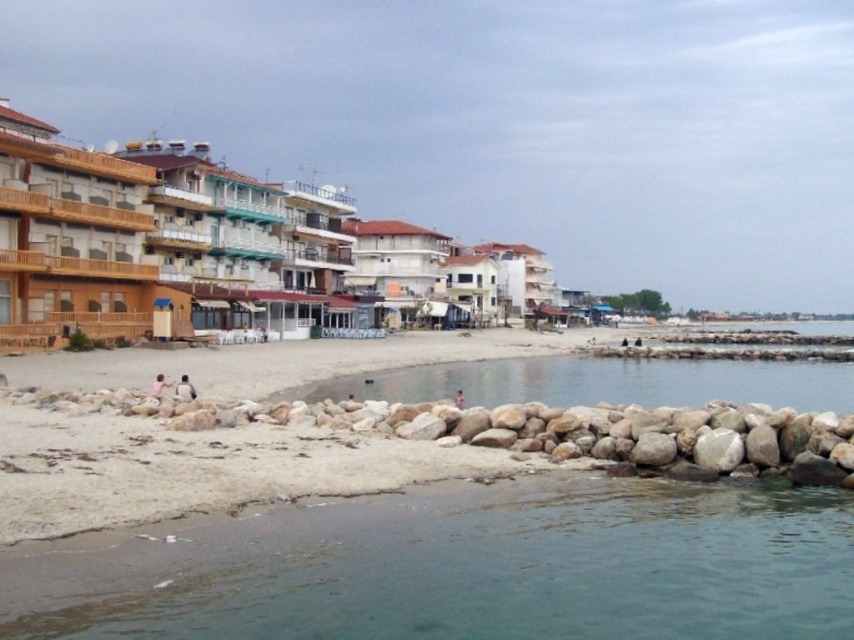
Question: Which of the following is the farthest from the observer?

Choices:
 (A) clear water at center
 (B) light brown wooden chair at lower left
 (C) light brown sand at center

Answer: (A)

Question: Among these points, which one is nearest to the camera?

Choices:
 (A) (18, 237)
 (B) (127, 228)

Answer: (A)

Question: Can you confirm if clear water at lower left is thinner than light brown sand at center?

Choices:
 (A) no
 (B) yes

Answer: (A)

Question: From the image, what is the correct spatial relationship of dark blue fabric person at lower left in relation to light brown wooden chair at lower left?

Choices:
 (A) below
 (B) above

Answer: (A)

Question: Does clear water at lower left appear under dark blue fabric person at lower left?

Choices:
 (A) no
 (B) yes

Answer: (B)

Question: Which object is closer to the camera taking this photo?

Choices:
 (A) dark blue fabric person at lower left
 (B) wooden balconies at center

Answer: (A)